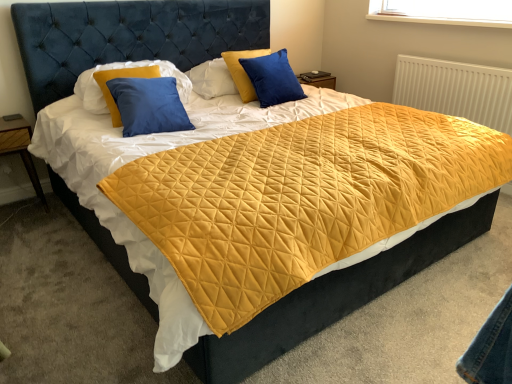
Question: From the image's perspective, is white textured radiator at upper right located beneath blue velvet pillow at upper center, which ranks as the 2th pillow in left-to-right order?

Choices:
 (A) no
 (B) yes

Answer: (B)

Question: Is there a large distance between white textured radiator at upper right and blue velvet pillow at upper center, the first pillow positioned from the right?

Choices:
 (A) no
 (B) yes

Answer: (B)

Question: Is the position of white textured radiator at upper right more distant than that of blue velvet pillow at upper center, the first pillow positioned from the right?

Choices:
 (A) yes
 (B) no

Answer: (A)

Question: Is white textured radiator at upper right shorter than blue velvet pillow at upper center, the first pillow positioned from the right?

Choices:
 (A) no
 (B) yes

Answer: (A)

Question: Is white textured radiator at upper right completely or partially outside of blue velvet pillow at upper center, the first pillow positioned from the right?

Choices:
 (A) yes
 (B) no

Answer: (A)

Question: From the image's perspective, does white textured radiator at upper right appear higher than blue velvet pillow at upper center, the first pillow positioned from the right?

Choices:
 (A) yes
 (B) no

Answer: (B)

Question: Does wooden at left have a greater height compared to blue matte pillow at upper left, which appears as the 1th pillow when viewed from the left?

Choices:
 (A) yes
 (B) no

Answer: (A)

Question: Considering the relative positions of wooden at left and blue matte pillow at upper left, which appears as the 1th pillow when viewed from the left, in the image provided, is wooden at left in front of blue matte pillow at upper left, which appears as the 1th pillow when viewed from the left,?

Choices:
 (A) yes
 (B) no

Answer: (B)

Question: From the image's perspective, is wooden at left beneath blue matte pillow at upper left, which appears as the 1th pillow when viewed from the left?

Choices:
 (A) yes
 (B) no

Answer: (A)

Question: Is wooden at left wider than blue matte pillow at upper left, the second pillow from the right?

Choices:
 (A) no
 (B) yes

Answer: (B)

Question: From the image's perspective, is wooden at left above blue matte pillow at upper left, the second pillow from the right?

Choices:
 (A) no
 (B) yes

Answer: (A)

Question: Is the depth of wooden at left greater than that of blue matte pillow at upper left, which appears as the 1th pillow when viewed from the left?

Choices:
 (A) no
 (B) yes

Answer: (B)

Question: Is blue velvet pillow at upper center, the first pillow positioned from the right, positioned far away from blue matte pillow at upper left, which appears as the 1th pillow when viewed from the left?

Choices:
 (A) yes
 (B) no

Answer: (B)